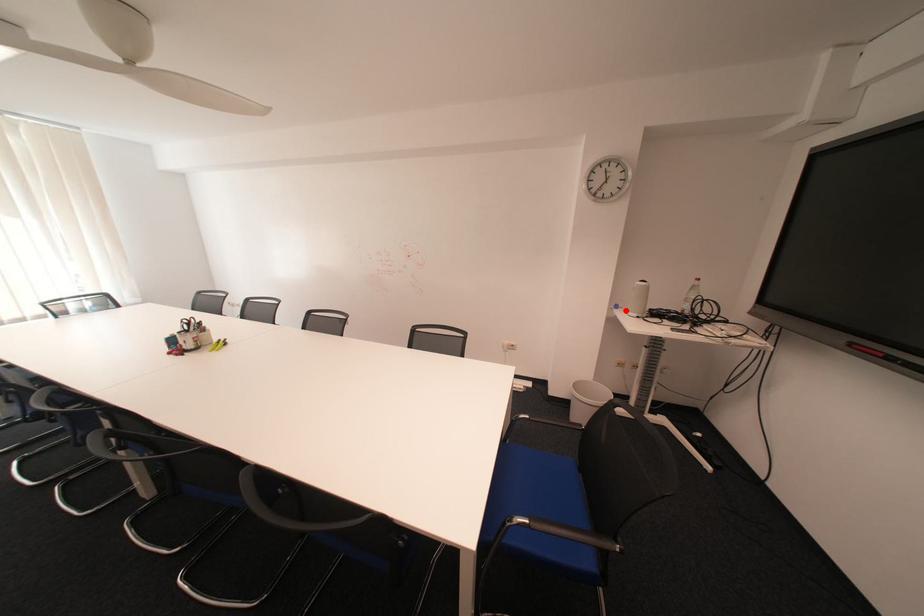
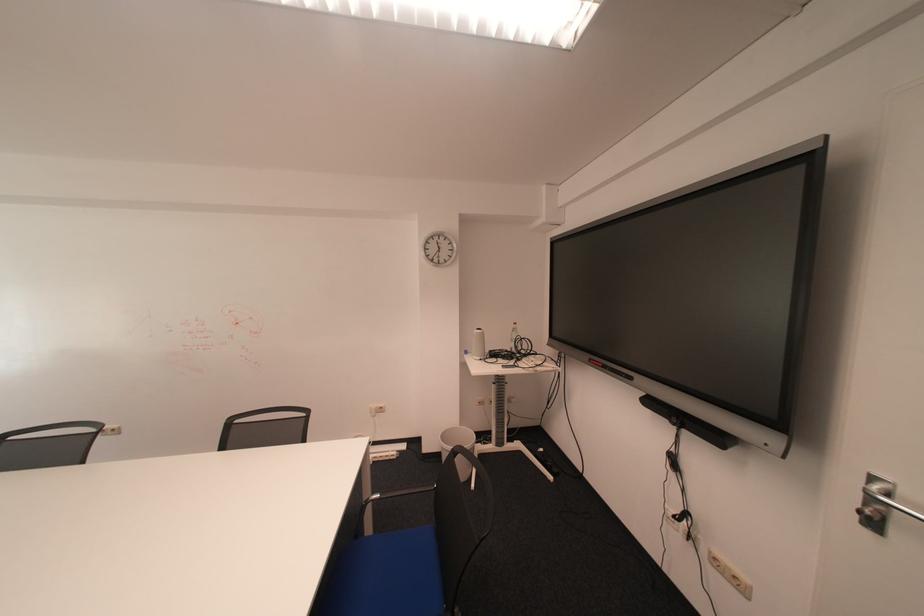
Locate, in the second image, the point that corresponds to the highlighted location in the first image.

(477, 355)